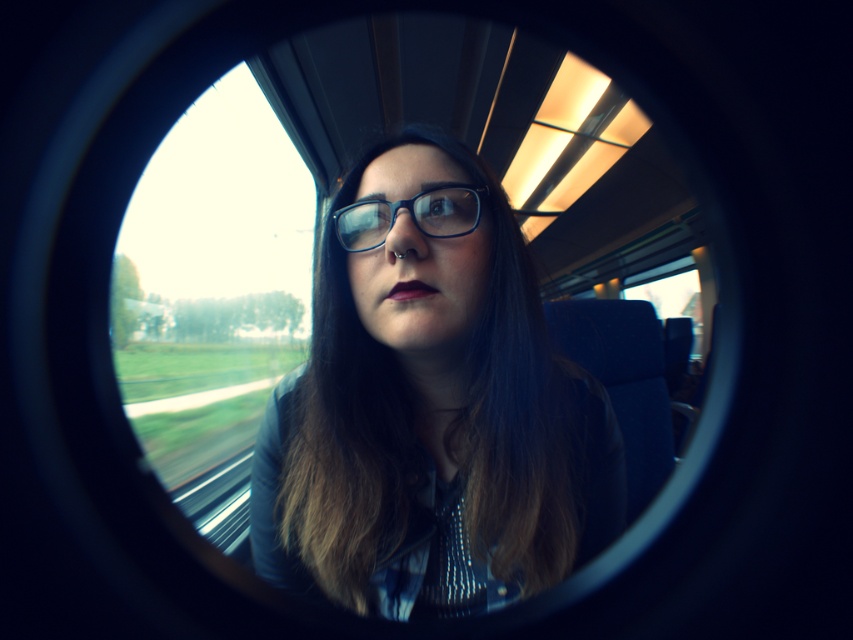
Question: Which object appears farthest from the camera in this image?

Choices:
 (A) transparent glass window at center
 (B) matte blue glasses at center

Answer: (A)

Question: From the image, what is the correct spatial relationship of transparent glass window at center in relation to blue plastic glasses at center?

Choices:
 (A) above
 (B) below

Answer: (B)

Question: Which object appears farthest from the camera in this image?

Choices:
 (A) blue plastic glasses at center
 (B) matte blue glasses at center
 (C) transparent glass window at center

Answer: (C)

Question: Does matte blue glasses at center appear on the right side of blue plastic glasses at center?

Choices:
 (A) no
 (B) yes

Answer: (B)

Question: Does matte blue glasses at center have a lesser width compared to blue plastic glasses at center?

Choices:
 (A) no
 (B) yes

Answer: (A)

Question: Which is farther from the blue plastic glasses at center?

Choices:
 (A) transparent glass window at center
 (B) matte blue glasses at center

Answer: (A)